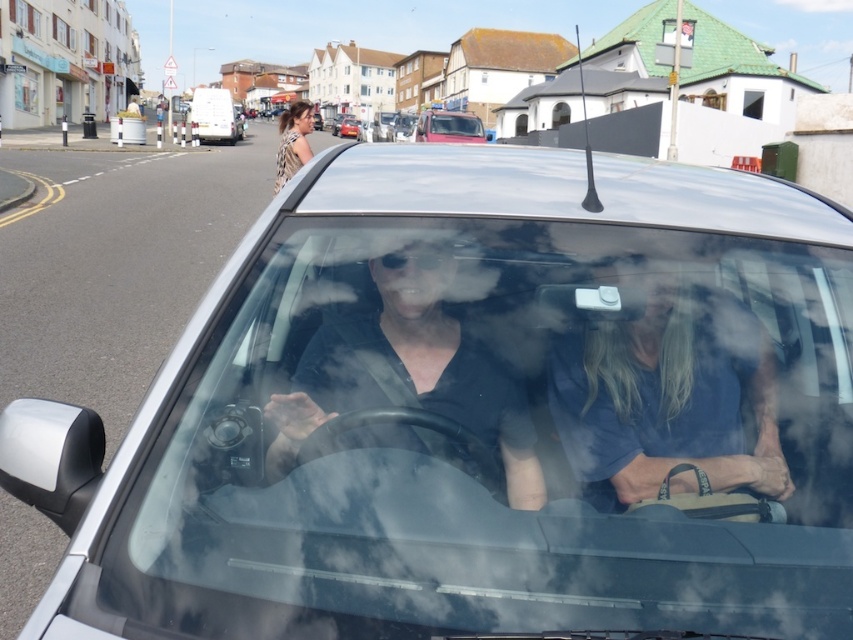
Which is more to the right, matte black shirt at center or transparent glass windshield at center?

Positioned to the right is transparent glass windshield at center.

Locate an element on the screen. Image resolution: width=853 pixels, height=640 pixels. matte black shirt at center is located at coordinates (410, 372).

Which of these two, blue fabric bag at center or transparent glass windshield at center, stands shorter?

blue fabric bag at center is shorter.

Between point (651, 294) and point (439, 124), which one is positioned in front?

Point (651, 294) is more forward.

The height and width of the screenshot is (640, 853). Find the location of `blue fabric bag at center`. blue fabric bag at center is located at coordinates (666, 396).

Can you confirm if blue fabric bag at center is taller than camouflage fabric top at upper center?

No.

Is blue fabric bag at center further to the viewer compared to camouflage fabric top at upper center?

No, it is not.

Who is more forward, (x=769, y=417) or (x=294, y=131)?

Positioned in front is point (x=769, y=417).

The height and width of the screenshot is (640, 853). What are the coordinates of `blue fabric bag at center` in the screenshot? It's located at (666, 396).